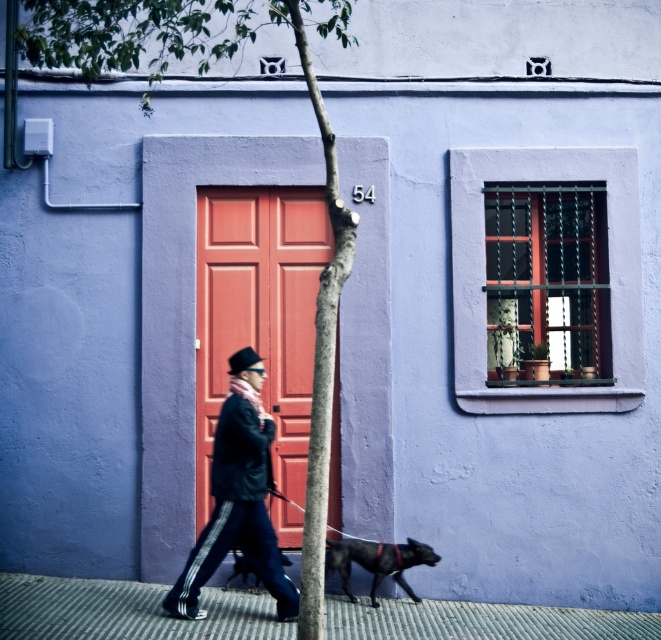
You are standing at the entrance of the building and want to walk to the ribbed concrete pavement at lower center. According to the coordinates provided, in which direction should you move relative to the building?

The ribbed concrete pavement at lower center is located at coordinates point (126,611), so you should move forward from the building entrance towards the lower center direction to reach it.

You are standing in front of the lavender building and see the green textured tree at center and the shiny black dog at lower center. Which object is closer to you?

The green textured tree at center is closer to the viewer than the shiny black dog at lower center.

You are a delivery person standing on the ribbed concrete pavement at lower center. You need to place a package on the shiny black dog at center. Is the dog large enough to hold the package?

The ribbed concrete pavement at lower center is bigger than the shiny black dog at center, so the dog may not be large enough to safely hold the package.